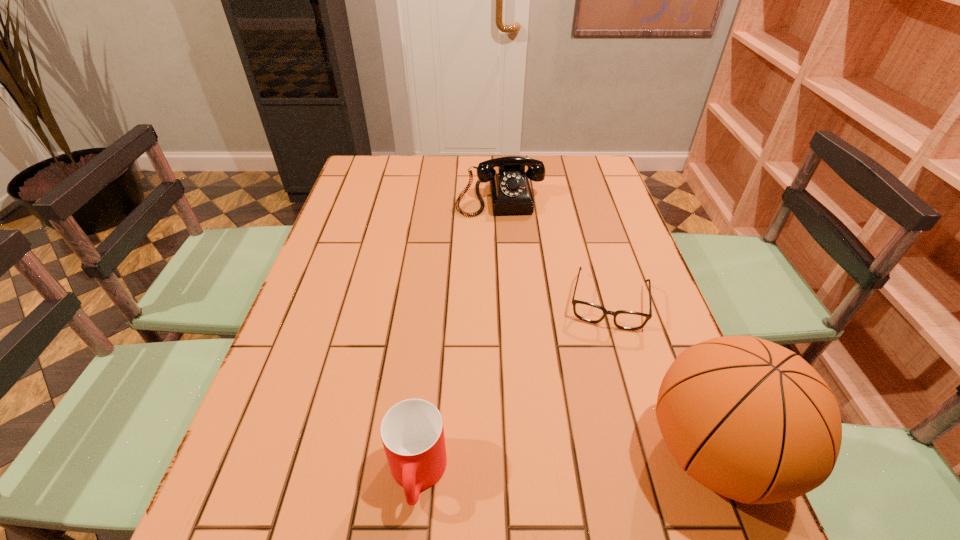
I want to click on vacant space at the right edge of the desktop, so click(644, 366).

The height and width of the screenshot is (540, 960). What are the coordinates of `free space at the far left corner of the desktop` in the screenshot? It's located at (364, 180).

Where is `vacant space at the near left corner of the desktop`? Image resolution: width=960 pixels, height=540 pixels. vacant space at the near left corner of the desktop is located at coordinates (290, 488).

This screenshot has width=960, height=540. Find the location of `vacant space at the far right corner of the desktop`. vacant space at the far right corner of the desktop is located at coordinates (603, 167).

At what (x,y) coordinates should I click in order to perform the action: click on vacant region between the tallest object and the telephone. Please return your answer as a coordinate pair (x, y). The image size is (960, 540). Looking at the image, I should click on (607, 325).

Find the location of a particular element. The image size is (960, 540). vacant area between the spectacles and the cup is located at coordinates (513, 388).

Where is `free space that is in between the tallest object and the cup`? The height and width of the screenshot is (540, 960). free space that is in between the tallest object and the cup is located at coordinates (565, 463).

Find the location of a particular element. vacant space that is in between the cup and the telephone is located at coordinates (459, 335).

Find the location of `vacant space that's between the spectacles and the basketball`. vacant space that's between the spectacles and the basketball is located at coordinates (660, 377).

Where is `vacant space in between the shortest object and the basketball`? The height and width of the screenshot is (540, 960). vacant space in between the shortest object and the basketball is located at coordinates (660, 377).